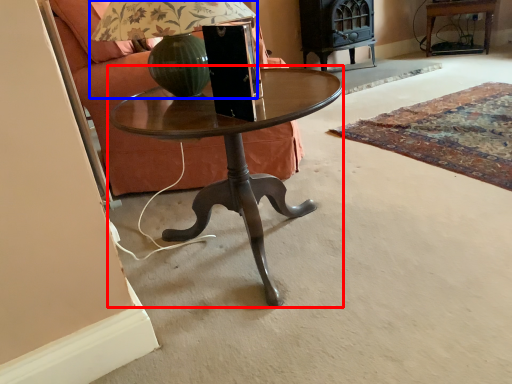
Question: Among these objects, which one is nearest to the camera, coffee table (highlighted by a red box) or table lamp (highlighted by a blue box)?

Choices:
 (A) coffee table
 (B) table lamp

Answer: (A)